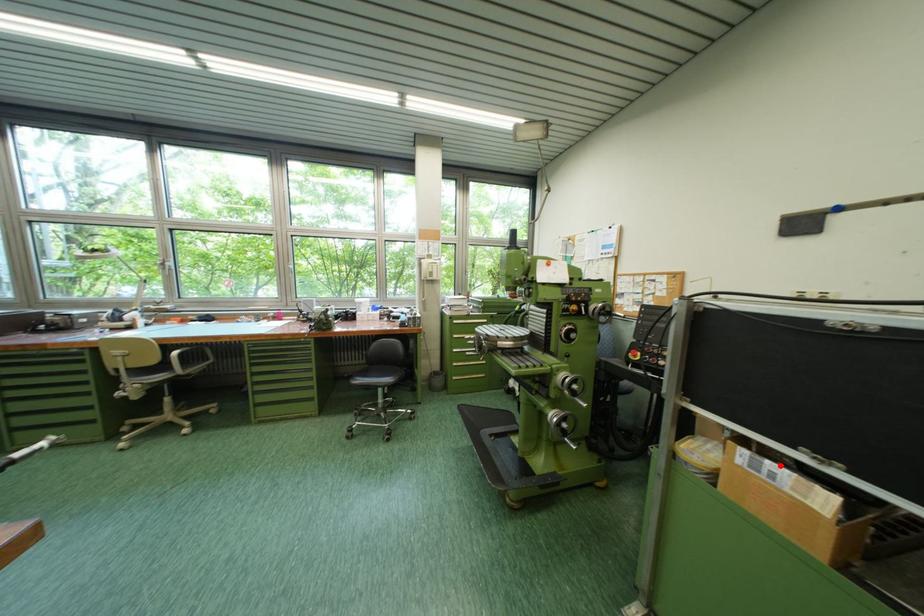
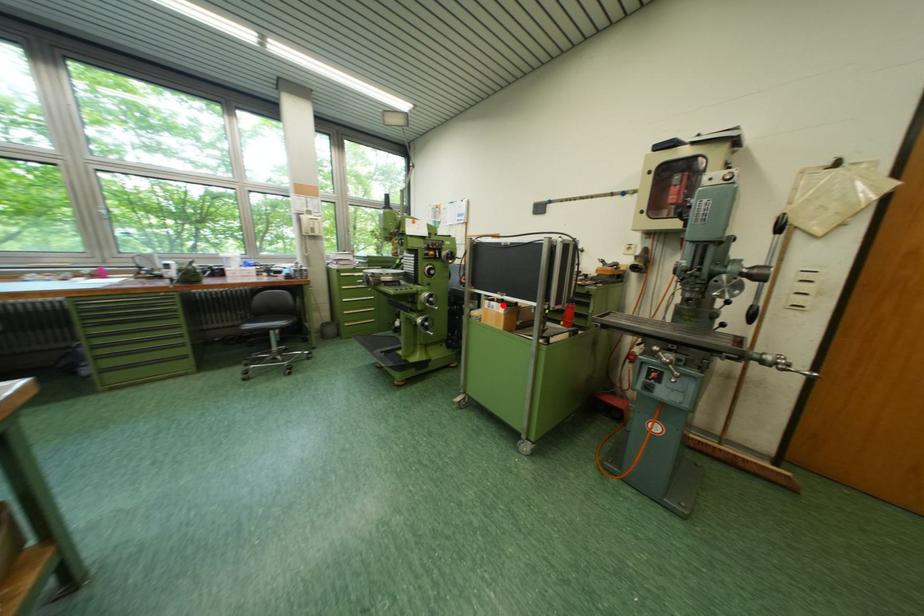
I am providing you with two images of the same scene from different viewpoints. A red point is marked on the first image and another point is marked on the second image. Do the highlighted points in image1 and image2 indicate the same real-world spot?

Yes